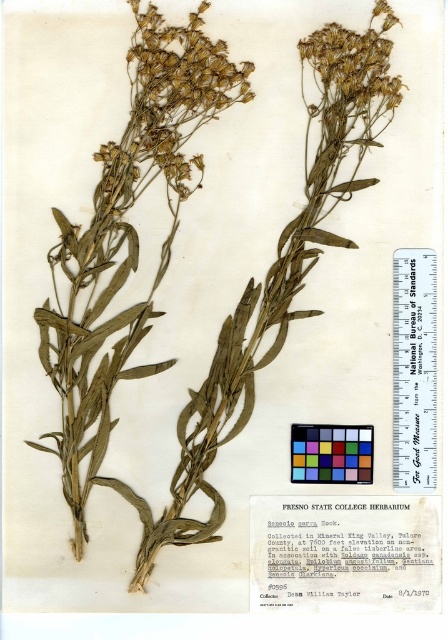
Based on the scene description, which of the two dry grass areas, the dry grass at upper left or the dry grass at upper center, is taller?

The dry grass at upper left is taller than the dry grass at upper center according to the specimen annotations.